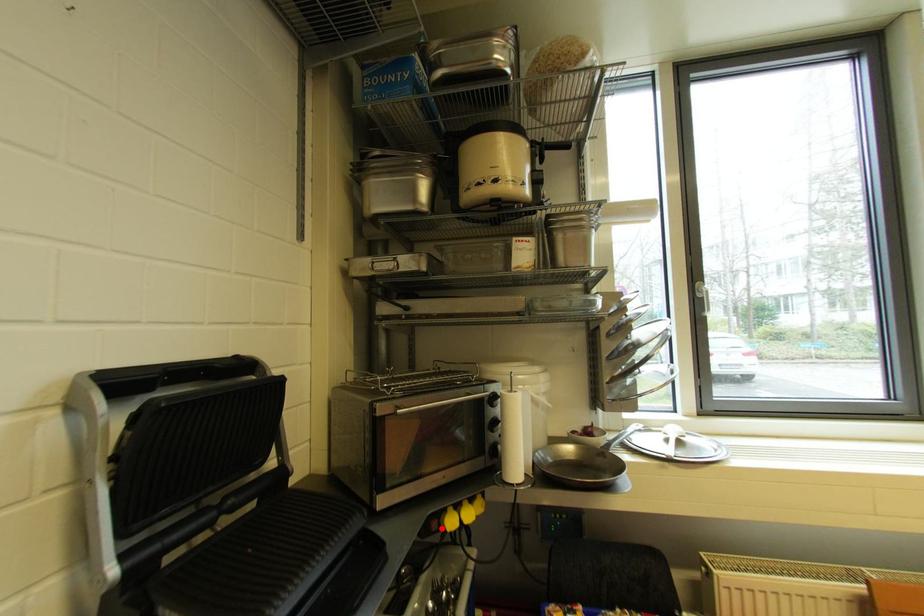
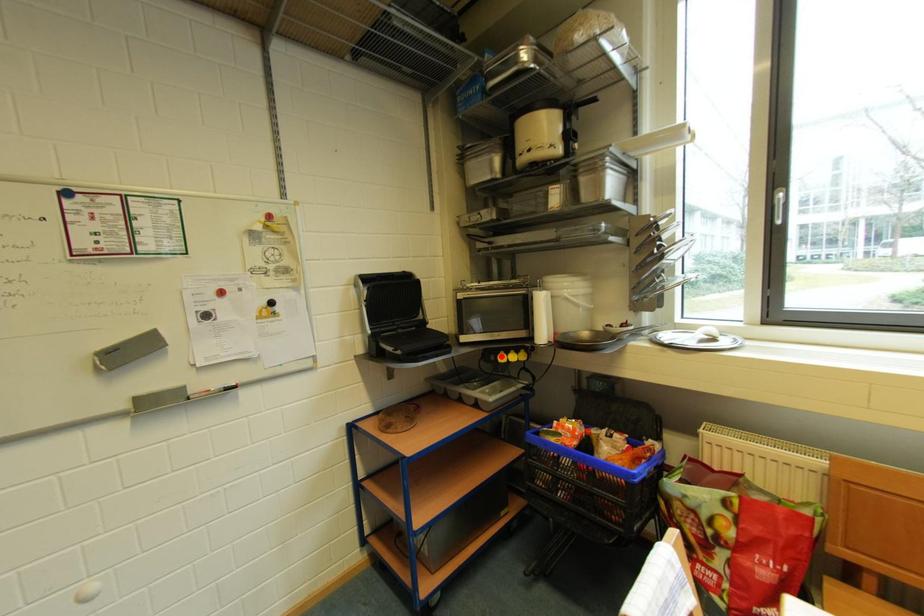
I am providing you with two images of the same scene from different viewpoints. A red point is marked on the first image and another point is marked on the second image. Is the marked point in image1 the same physical position as the marked point in image2?

No